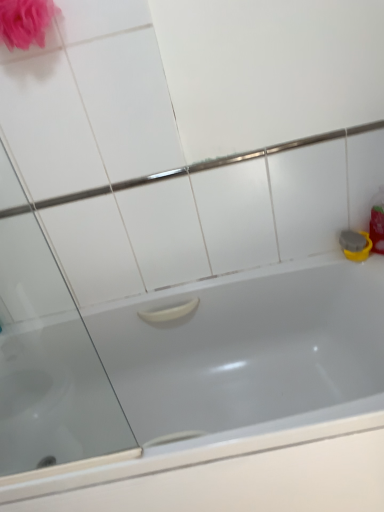
Question: Is white glossy bathtub at center positioned with its back to matte pink sponge at upper left?

Choices:
 (A) no
 (B) yes

Answer: (A)

Question: Is white glossy bathtub at center not inside matte pink sponge at upper left?

Choices:
 (A) yes
 (B) no

Answer: (A)

Question: From the image's perspective, is white glossy bathtub at center beneath matte pink sponge at upper left?

Choices:
 (A) no
 (B) yes

Answer: (B)

Question: Would you say matte pink sponge at upper left is part of white glossy bathtub at center's contents?

Choices:
 (A) yes
 (B) no

Answer: (B)

Question: Is white glossy bathtub at center positioned in front of matte pink sponge at upper left?

Choices:
 (A) no
 (B) yes

Answer: (B)

Question: Can you confirm if white glossy bathtub at center is positioned to the left of matte pink sponge at upper left?

Choices:
 (A) no
 (B) yes

Answer: (A)

Question: Does matte pink sponge at upper left come behind white glossy bathtub at center?

Choices:
 (A) no
 (B) yes

Answer: (B)

Question: From a real-world perspective, is matte pink sponge at upper left on top of white glossy bathtub at center?

Choices:
 (A) no
 (B) yes

Answer: (B)

Question: From the image's perspective, would you say matte pink sponge at upper left is shown under white glossy bathtub at center?

Choices:
 (A) no
 (B) yes

Answer: (A)

Question: Is matte pink sponge at upper left not inside white glossy bathtub at center?

Choices:
 (A) no
 (B) yes

Answer: (B)

Question: Considering the relative sizes of matte pink sponge at upper left and white glossy bathtub at center in the image provided, is matte pink sponge at upper left thinner than white glossy bathtub at center?

Choices:
 (A) no
 (B) yes

Answer: (B)

Question: Does matte pink sponge at upper left appear on the right side of white glossy bathtub at center?

Choices:
 (A) yes
 (B) no

Answer: (B)

Question: Is point (52, 8) positioned closer to the camera than point (210, 311)?

Choices:
 (A) farther
 (B) closer

Answer: (B)